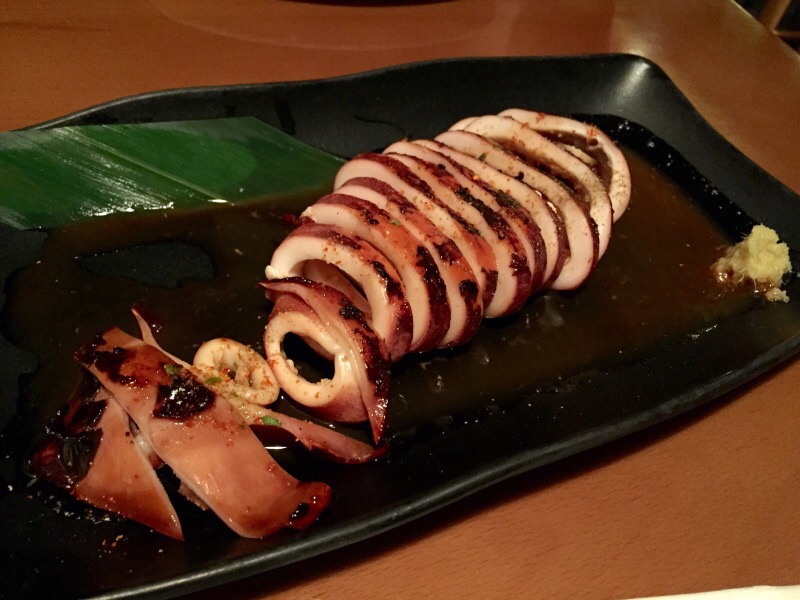
Locate an element on the screen. The image size is (800, 600). empty space behind and right of the table is located at coordinates (786, 32).